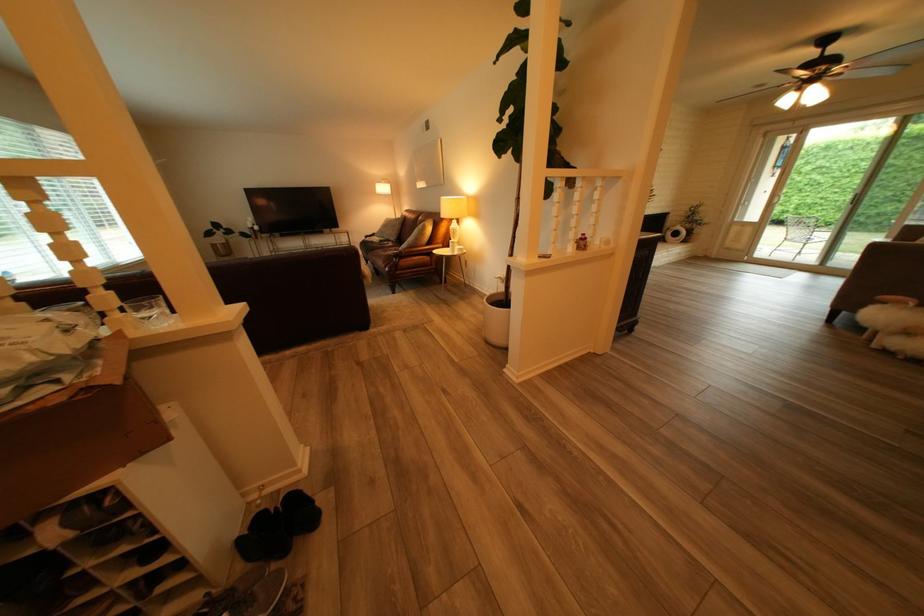
Locate an element on the screen. Image resolution: width=924 pixels, height=616 pixels. dark pillow is located at coordinates (390, 228).